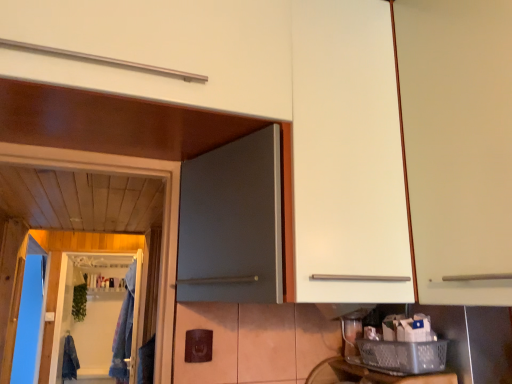
Question: Which is correct: denim jacket at lower left, which is counted as the second laundry, starting from the front, is inside metallic silver basket at lower right, or outside of it?

Choices:
 (A) outside
 (B) inside

Answer: (A)

Question: Is denim jacket at lower left, which is counted as the second laundry, starting from the front, bigger or smaller than metallic silver basket at lower right?

Choices:
 (A) small
 (B) big

Answer: (B)

Question: Based on their relative distances, which object is farther from the metallic silver basket at lower right?

Choices:
 (A) white matte cabinet at right
 (B) clear plastic basket at lower right
 (C) clear plastic screen door at lower left
 (D) blue fabric laundry at left, arranged as the 2th laundry when ordered from the bottom
 (E) denim jacket at lower left, positioned as the 1th laundry in back-to-front order

Answer: (E)

Question: Which is farther from the blue fabric laundry at left, positioned as the second laundry in back-to-front order?

Choices:
 (A) metallic silver basket at lower right
 (B) white matte cabinet at right
 (C) clear plastic screen door at lower left
 (D) clear plastic basket at lower right
 (E) denim jacket at lower left, which is counted as the second laundry, starting from the front

Answer: (B)